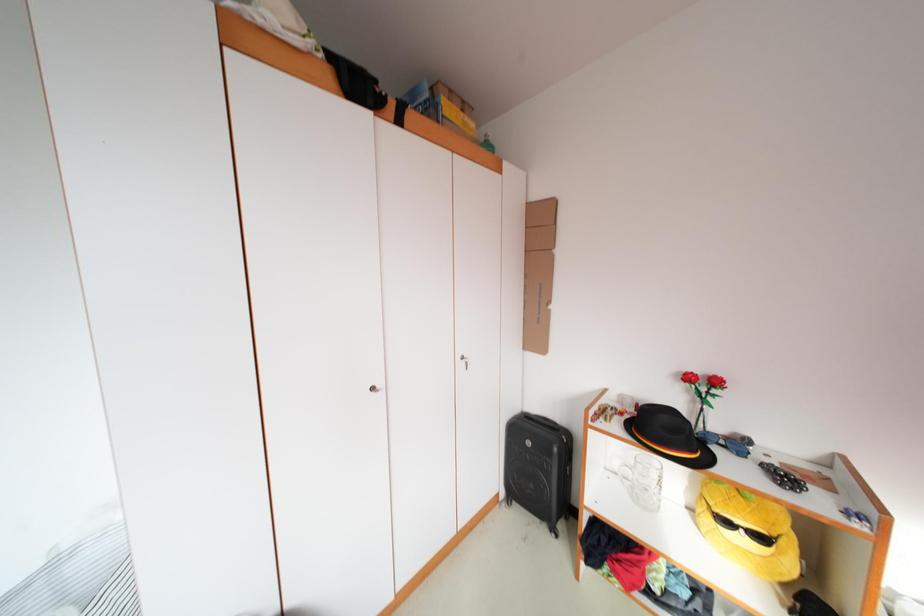
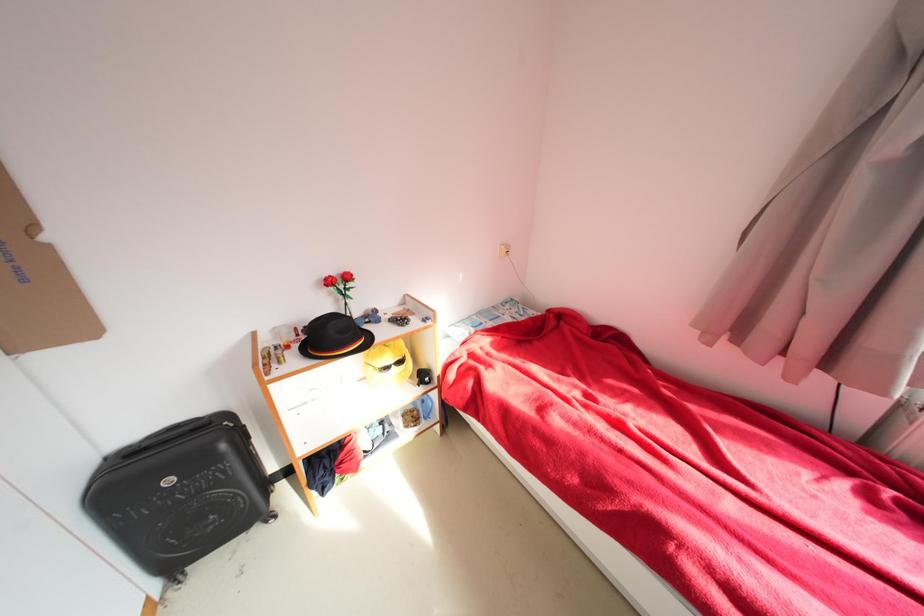
The first image is from the beginning of the video and the second image is from the end. How did the camera likely rotate when shooting the video?

The camera rotated toward right-down.